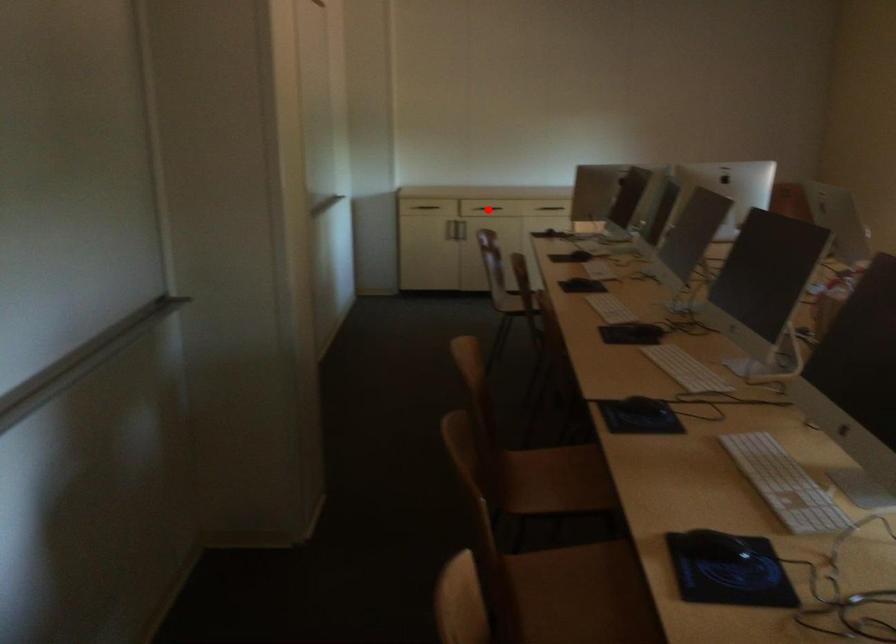
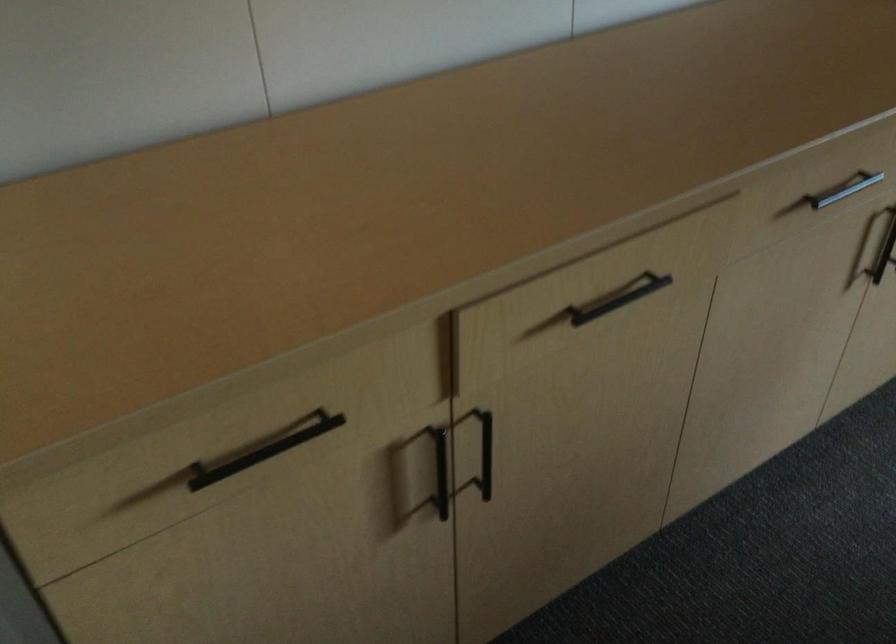
Question: I am providing you with two images of the same scene from different viewpoints. A red point is marked on the first image. At the location where the point appears in image 1, is it still visible in image 2?

Choices:
 (A) Yes
 (B) No

Answer: (B)